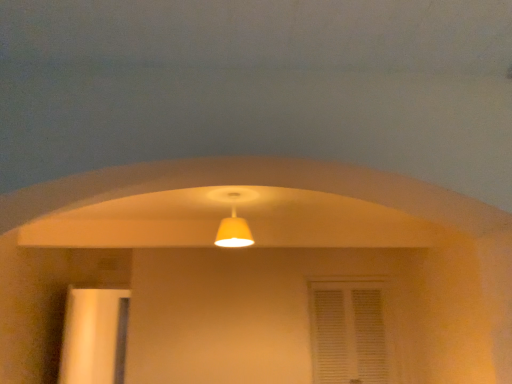
Question: Is point (224, 231) positioned closer to the camera than point (110, 334)?

Choices:
 (A) closer
 (B) farther

Answer: (A)

Question: Looking at the image, does matte yellow lampshade at center seem bigger or smaller compared to wooden door at left?

Choices:
 (A) big
 (B) small

Answer: (B)

Question: Based on their relative distances, which object is farther from the matte yellow lampshade at center?

Choices:
 (A) white textured window at center
 (B) wooden door at left

Answer: (B)

Question: Estimate the real-world distances between objects in this image. Which object is farther from the wooden door at left?

Choices:
 (A) white textured window at center
 (B) matte yellow lampshade at center

Answer: (A)